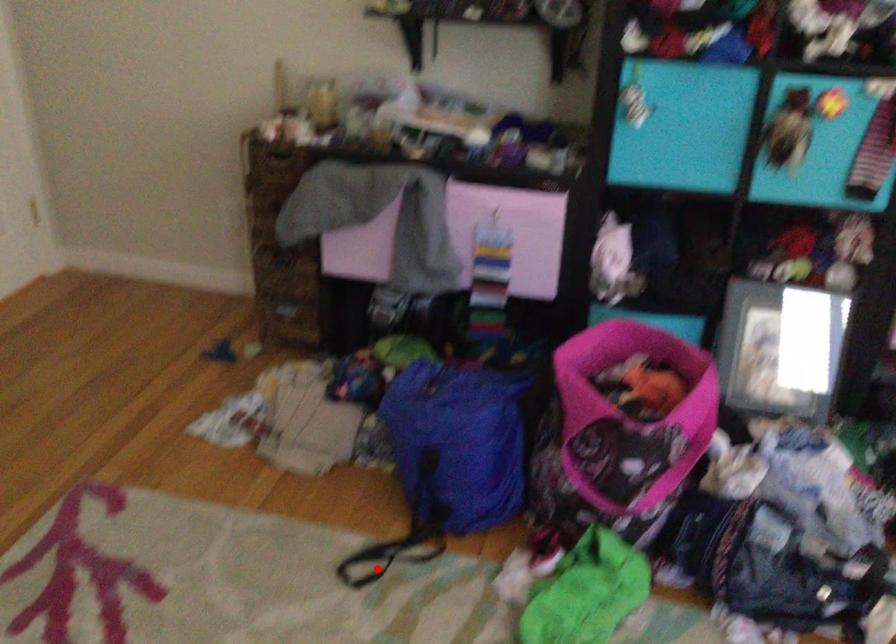
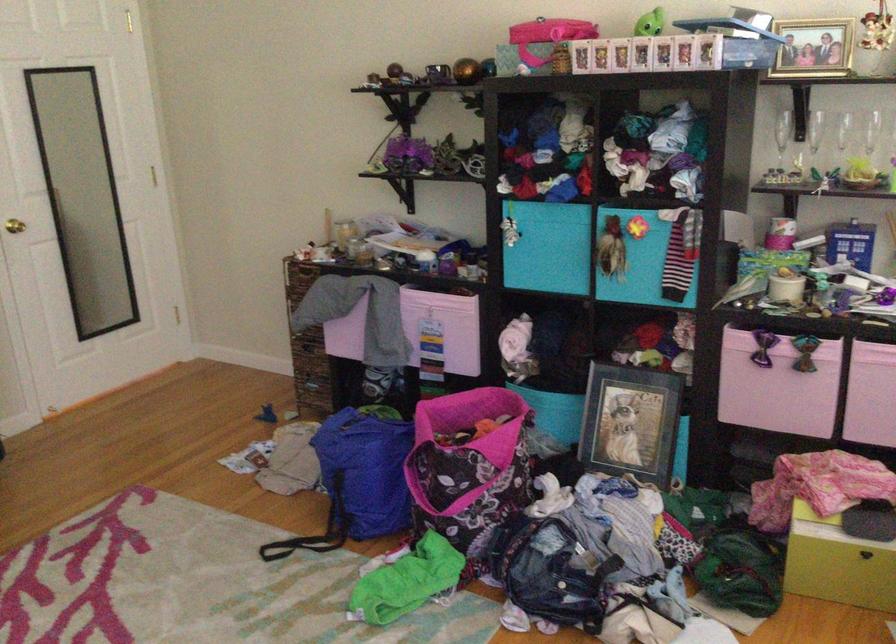
Question: I am providing you with two images of the same scene from different viewpoints. Given a red point in image1, look at the same physical point in image2. Is it:

Choices:
 (A) Closer to the viewpoint
 (B) Farther from the viewpoint

Answer: (B)